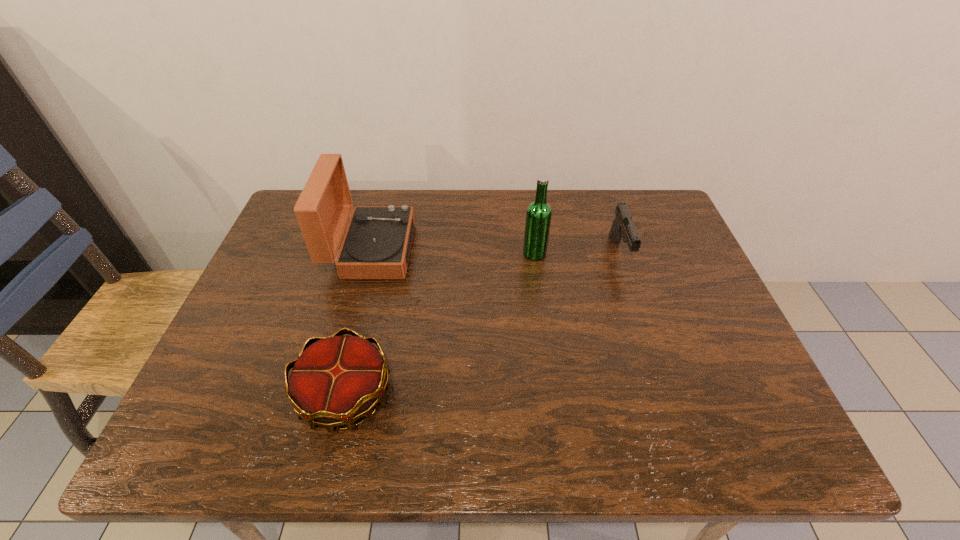
In order to click on vacant area that lies between the pistol and the beer bottle in this screenshot , I will do `click(577, 254)`.

Image resolution: width=960 pixels, height=540 pixels. Identify the location of free space that is in between the phonograph record and the beer bottle. (453, 252).

Where is `vacant region between the phonograph record and the pistol`? vacant region between the phonograph record and the pistol is located at coordinates (495, 252).

Locate an element on the screen. The width and height of the screenshot is (960, 540). vacant point located between the shortest object and the rightmost object is located at coordinates (483, 325).

I want to click on empty space between the shortest object and the beer bottle, so click(441, 325).

You are a GUI agent. You are given a task and a screenshot of the screen. Output one action in this format:
    pyautogui.click(x=<x>, y=<y>)
    Task: Click on the unoccupied position between the phonograph record and the beer bottle
    
    Given the screenshot: What is the action you would take?
    pyautogui.click(x=453, y=252)

You are a GUI agent. You are given a task and a screenshot of the screen. Output one action in this format:
    pyautogui.click(x=<x>, y=<y>)
    Task: Click on the vacant space that is in between the beer bottle and the phonograph record
    This screenshot has height=540, width=960.
    Given the screenshot: What is the action you would take?
    pyautogui.click(x=453, y=252)

Identify which object is the second closest to the phonograph record. Please provide its 2D coordinates. Your answer should be formatted as a tuple, i.e. [(x, y)], where the tuple contains the x and y coordinates of a point satisfying the conditions above.

[(538, 216)]

You are a GUI agent. You are given a task and a screenshot of the screen. Output one action in this format:
    pyautogui.click(x=<x>, y=<y>)
    Task: Click on the object that can be found as the third closest to the second object from right to left
    Image resolution: width=960 pixels, height=540 pixels.
    Given the screenshot: What is the action you would take?
    pyautogui.click(x=335, y=380)

This screenshot has width=960, height=540. Identify the location of vacant space that satisfies the following two spatial constraints: 1. on the face of the phonograph record; 2. on the back side of the third object from left to right. (371, 253).